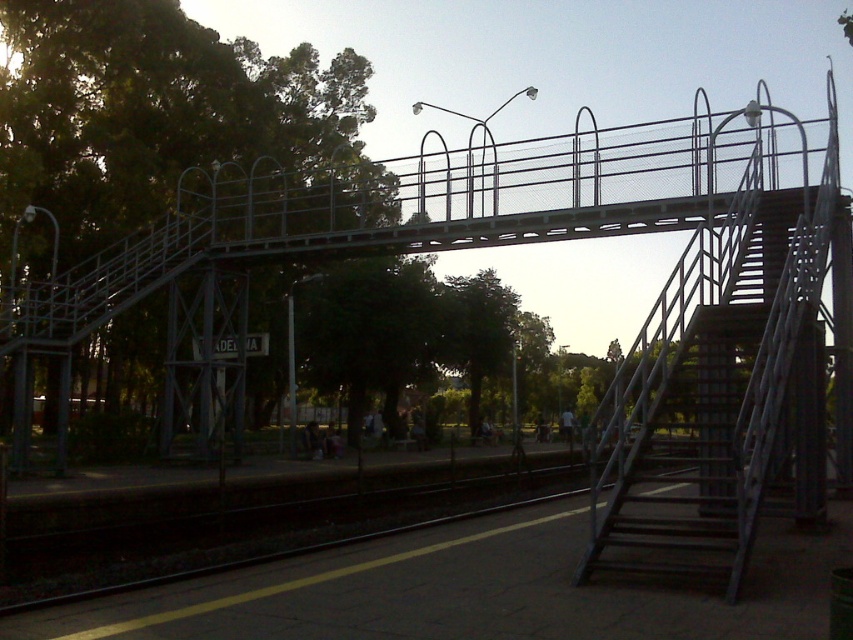
Question: Does green leafy tree at upper center have a smaller size compared to green leafy tree at center?

Choices:
 (A) yes
 (B) no

Answer: (B)

Question: Which of these objects is positioned farthest from the green leafy tree at upper center?

Choices:
 (A) green leafy tree at center
 (B) metallic gray staircase at center

Answer: (B)

Question: Can you confirm if green leafy tree at upper center is positioned to the right of green leafy tree at center?

Choices:
 (A) no
 (B) yes

Answer: (A)

Question: Estimate the real-world distances between objects in this image. Which object is closer to the green leafy tree at center?

Choices:
 (A) green leafy tree at upper center
 (B) metallic gray staircase at center

Answer: (A)

Question: In this image, where is metallic gray staircase at center located relative to green leafy tree at center?

Choices:
 (A) above
 (B) below

Answer: (B)

Question: Which object is the farthest from the green leafy tree at upper center?

Choices:
 (A) green leafy tree at center
 (B) metallic gray staircase at center

Answer: (B)